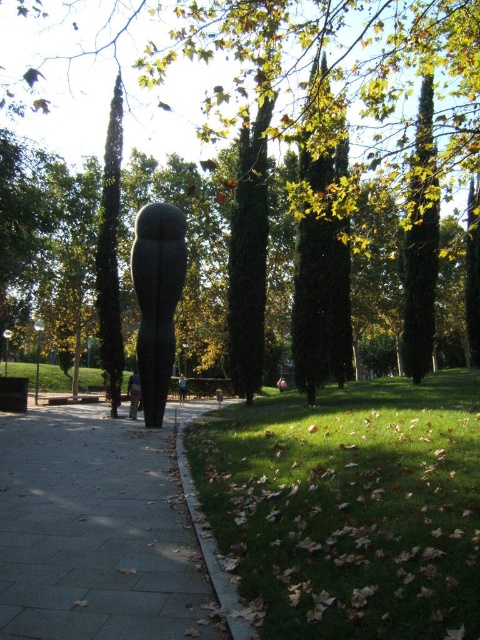
Can you confirm if green grass at lower right is positioned to the right of skinny jeans at center?

Correct, you'll find green grass at lower right to the right of skinny jeans at center.

Between point (443, 545) and point (133, 394), which one is positioned behind?

Positioned behind is point (133, 394).

Does point (446, 385) come farther from viewer compared to point (132, 392)?

Yes.

The height and width of the screenshot is (640, 480). I want to click on green grass at lower right, so click(349, 508).

Is green textured tree at center positioned before light brown wooden pole at center?

Yes, it is in front of light brown wooden pole at center.

Can you confirm if green textured tree at center is positioned above light brown wooden pole at center?

Correct, green textured tree at center is located above light brown wooden pole at center.

Which is in front, point (129, 8) or point (181, 394)?

Point (181, 394)

You are a GUI agent. You are given a task and a screenshot of the screen. Output one action in this format:
    pyautogui.click(x=<x>, y=<y>)
    Task: Click on the green textured tree at center
    Image resolution: width=480 pixels, height=640 pixels.
    Given the screenshot: What is the action you would take?
    pyautogui.click(x=72, y=54)

Is gray stone sculpture at center smaller than skinny jeans at center?

Indeed, gray stone sculpture at center has a smaller size compared to skinny jeans at center.

Is gray stone sculpture at center to the left of skinny jeans at center from the viewer's perspective?

Incorrect, gray stone sculpture at center is not on the left side of skinny jeans at center.

Is point (171, 298) closer to camera compared to point (133, 403)?

Yes, it is in front of point (133, 403).

Where is `gray stone sculpture at center`? This screenshot has height=640, width=480. gray stone sculpture at center is located at coordinates (156, 300).